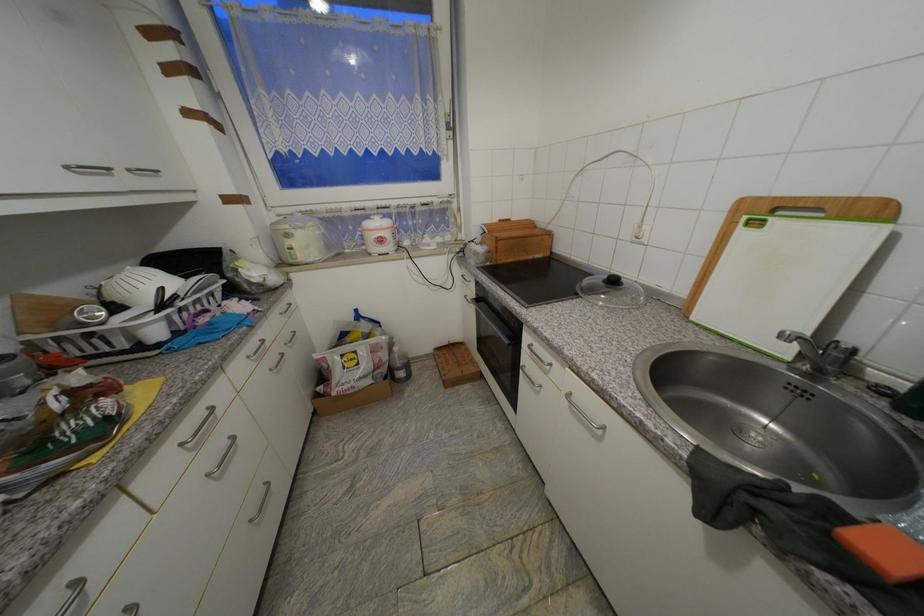
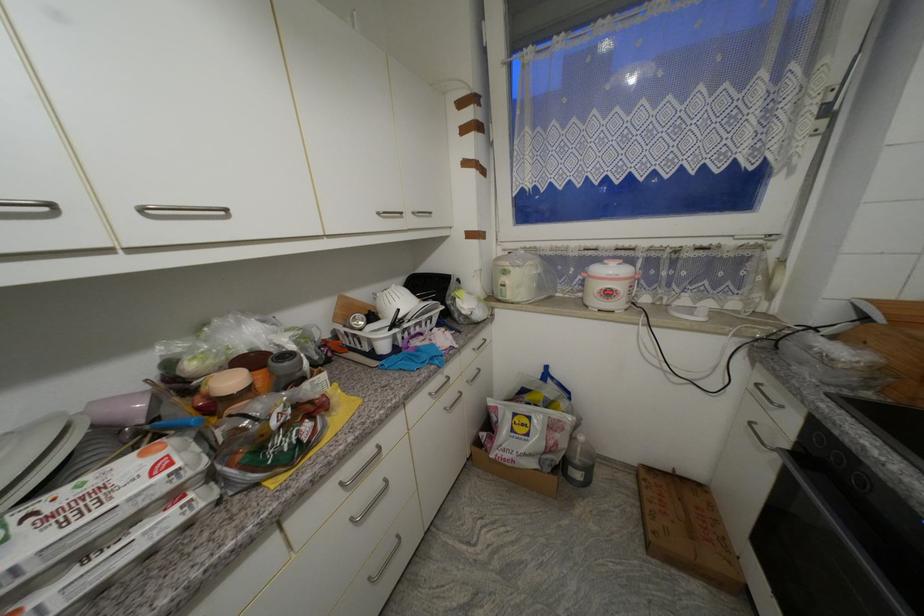
Locate, in the second image, the point that corresponds to point 188,446 in the first image.

(347, 485)